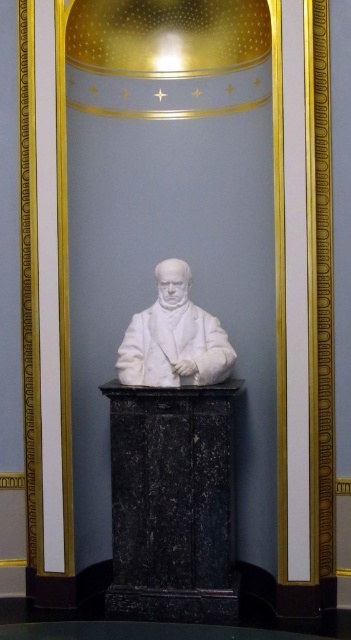
Based on the photo, which is more to the left, black marble pedestal at center or white marble bust at center?

Positioned to the left is white marble bust at center.

In the scene shown: Between black marble pedestal at center and white marble bust at center, which one has less height?

white marble bust at center is shorter.

Which is behind, point (226, 476) or point (133, 332)?

The point (133, 332) is behind.

Where is `black marble pedestal at center`? black marble pedestal at center is located at coordinates (171, 502).